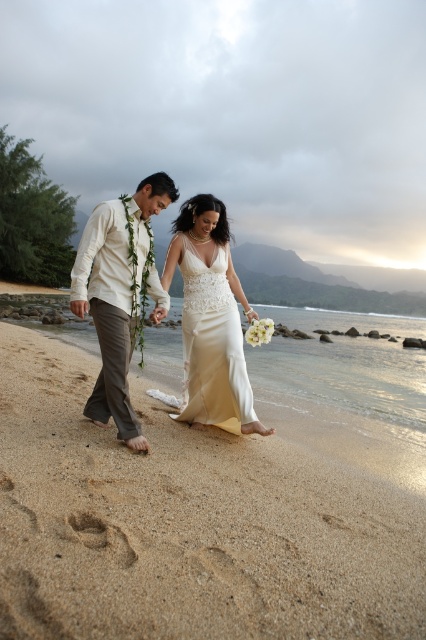
Between ivory satin dress at center and brown sandy footprint at lower center, which one has more height?

Standing taller between the two is ivory satin dress at center.

Is ivory satin dress at center positioned at the back of brown sandy footprint at lower center?

Yes, it is.

This screenshot has height=640, width=426. Identify the location of ivory satin dress at center. (212, 344).

Can you confirm if white cotton shirt at center is positioned to the right of ivory satin dress at center?

Incorrect, white cotton shirt at center is not on the right side of ivory satin dress at center.

The height and width of the screenshot is (640, 426). What do you see at coordinates (118, 294) in the screenshot?
I see `white cotton shirt at center` at bounding box center [118, 294].

Is point (126, 342) positioned before point (190, 257)?

Yes, point (126, 342) is closer to viewer.

Identify the location of white cotton shirt at center. The width and height of the screenshot is (426, 640). (118, 294).

Is light beige sand at lower center wider than ivory satin dress at center?

Yes, light beige sand at lower center is wider than ivory satin dress at center.

Between light beige sand at lower center and ivory satin dress at center, which one appears on the right side from the viewer's perspective?

From the viewer's perspective, light beige sand at lower center appears more on the right side.

Identify the location of light beige sand at lower center. pos(189,524).